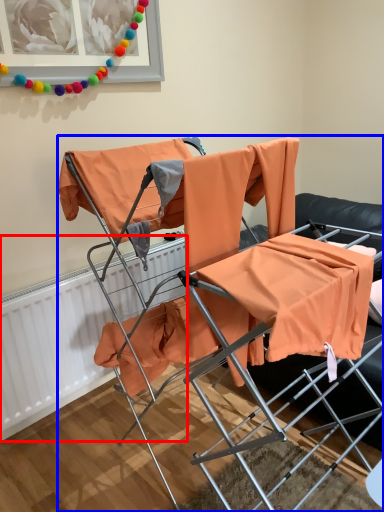
Question: Which object is closer to the camera taking this photo, radiator (highlighted by a red box) or chair (highlighted by a blue box)?

Choices:
 (A) radiator
 (B) chair

Answer: (B)